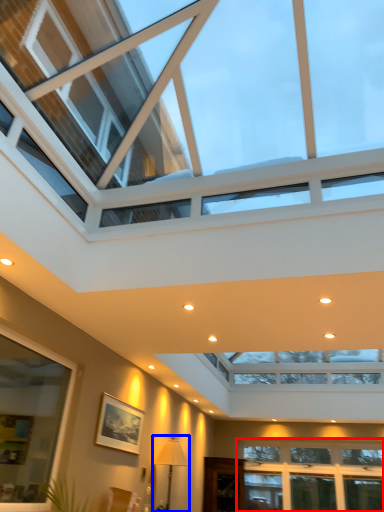
Question: Which object appears closest to the camera in this image, window (highlighted by a red box) or lamp (highlighted by a blue box)?

Choices:
 (A) window
 (B) lamp

Answer: (B)